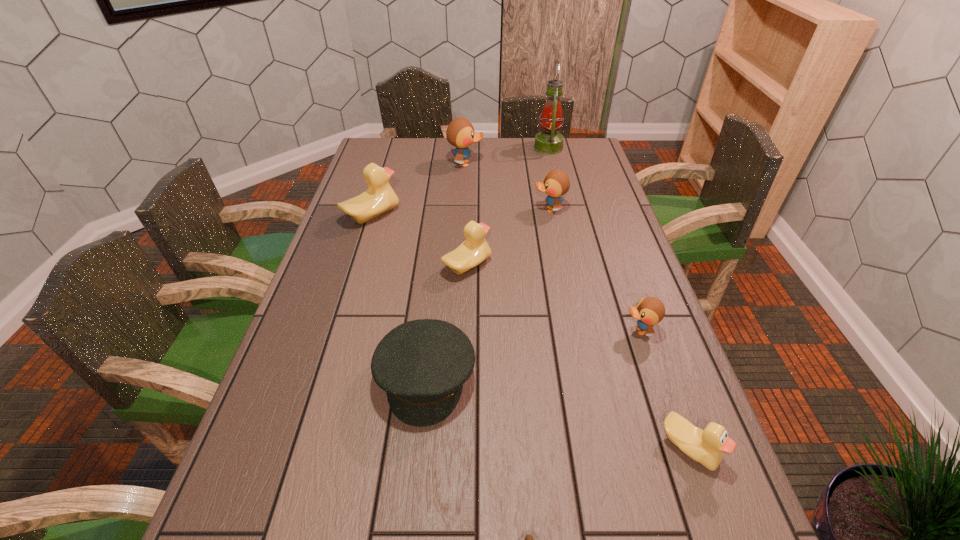
This screenshot has width=960, height=540. Find the location of `free space between the fifth farthest duck and the biggest blue duck`. free space between the fifth farthest duck and the biggest blue duck is located at coordinates point(553,247).

Where is `free area in between the gray beret and the oil lamp`? free area in between the gray beret and the oil lamp is located at coordinates (487, 264).

Find the location of a particular element. Image resolution: width=960 pixels, height=540 pixels. vacant area that lies between the beret and the biggest beige duck is located at coordinates pyautogui.click(x=399, y=297).

Find the location of a particular element. The width and height of the screenshot is (960, 540). blank region between the tallest object and the smallest blue duck is located at coordinates (594, 239).

I want to click on unoccupied area between the leftmost beige duck and the smallest blue duck, so click(506, 273).

At what (x,y) coordinates should I click in order to perform the action: click on object identified as the fifth closest to the fifth object from right to left. Please return your answer as a coordinate pair (x, y). The width and height of the screenshot is (960, 540). Looking at the image, I should click on (379, 198).

Locate which object ranks eighth in proximity to the leftmost beige duck. Please provide its 2D coordinates. Your answer should be formatted as a tuple, i.e. [(x, y)], where the tuple contains the x and y coordinates of a point satisfying the conditions above.

[(529, 539)]

Point out which duck is positioned as the fifth nearest to the gray beret. Please provide its 2D coordinates. Your answer should be formatted as a tuple, i.e. [(x, y)], where the tuple contains the x and y coordinates of a point satisfying the conditions above.

[(556, 183)]

Locate an element on the screen. This screenshot has height=540, width=960. the closest duck relative to the gray beret is located at coordinates (474, 250).

Image resolution: width=960 pixels, height=540 pixels. Find the location of `blue duck identified as the closest to the rightmost beige duck`. blue duck identified as the closest to the rightmost beige duck is located at coordinates (649, 311).